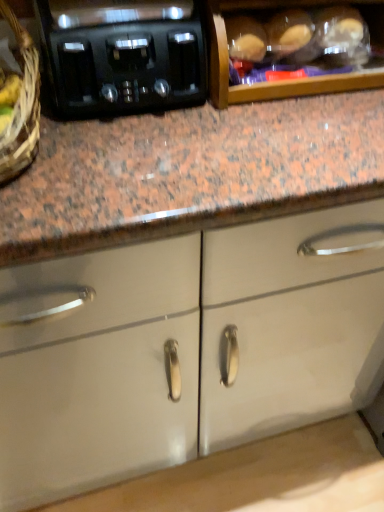
Question: Is point (241, 90) positioned closer to the camera than point (203, 287)?

Choices:
 (A) closer
 (B) farther

Answer: (B)

Question: Is wooden cabinet at upper center, which ranks as the 2th cabinetry in back-to-front order, taller or shorter than white glossy cabinet doors at center, placed as the first cabinetry when sorted from bottom to top?

Choices:
 (A) short
 (B) tall

Answer: (B)

Question: Considering the real-world distances, which object is closest to the black plastic toaster at upper left?

Choices:
 (A) white glossy cabinet doors at center, acting as the 2th cabinetry starting from the top
 (B) woven brown basket at left
 (C) wooden cabinet at upper center, the second cabinetry positioned from the bottom

Answer: (B)

Question: Based on their relative distances, which object is farther from the black plastic toaster at upper left?

Choices:
 (A) woven brown basket at left
 (B) white glossy cabinet doors at center, acting as the 2th cabinetry starting from the top
 (C) wooden cabinet at upper center, the second cabinetry positioned from the bottom

Answer: (B)